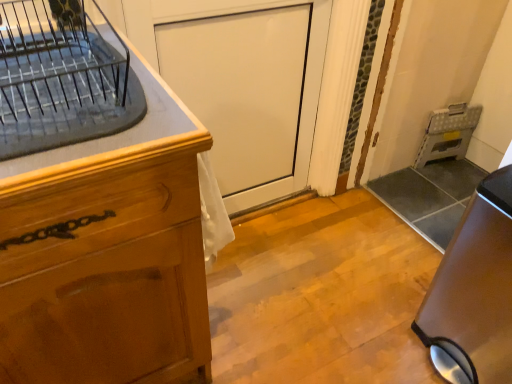
Where is `free space in front of metallic gray folding step stool at right`? This screenshot has width=512, height=384. free space in front of metallic gray folding step stool at right is located at coordinates (436, 176).